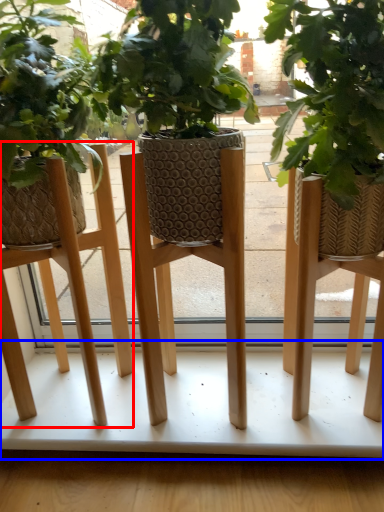
Question: Which point is further to the camera, stool (highlighted by a red box) or table (highlighted by a blue box)?

Choices:
 (A) stool
 (B) table

Answer: (B)